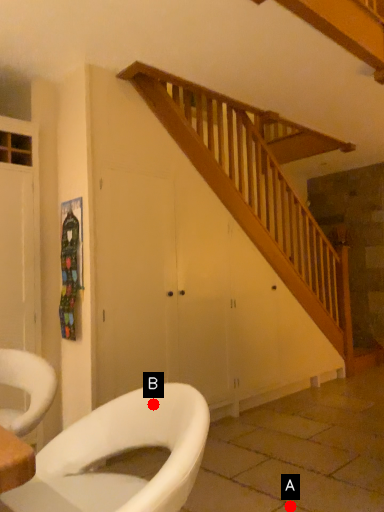
Question: Two points are circled on the image, labeled by A and B beside each circle. Which of the following is the closest to the observer?

Choices:
 (A) A is closer
 (B) B is closer

Answer: (B)